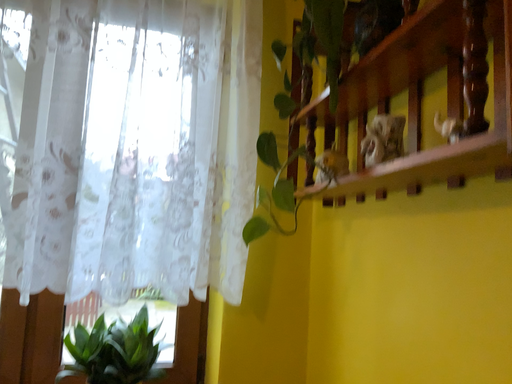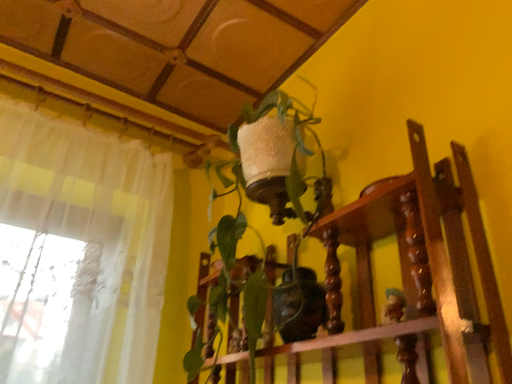
Question: How did the camera likely rotate when shooting the video?

Choices:
 (A) rotated left
 (B) rotated right

Answer: (B)